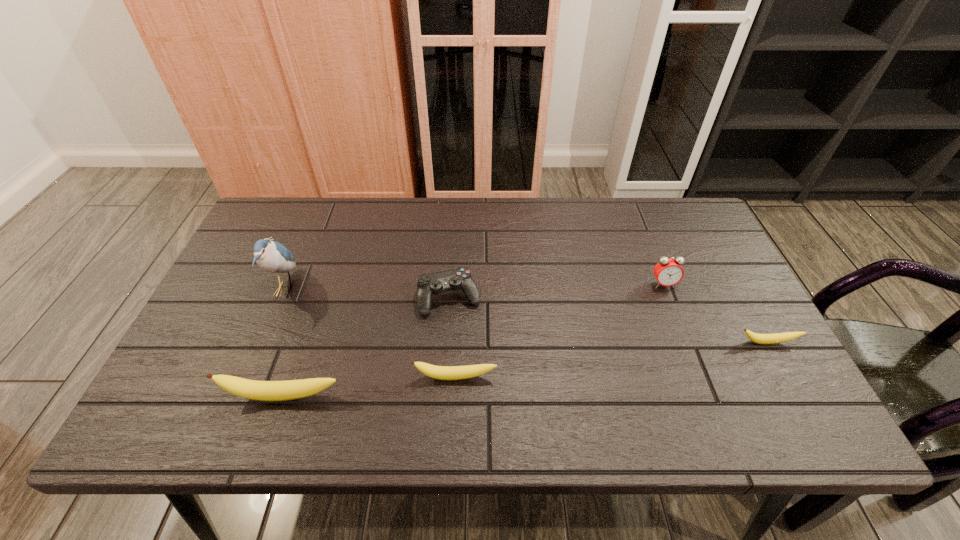
If we want them evenly spaced by inserting an extra banana among them, please locate a free spot for this new banana. Please provide its 2D coordinates. Your answer should be formatted as a tuple, i.e. [(x, y)], where the tuple contains the x and y coordinates of a point satisfying the conditions above.

[(616, 359)]